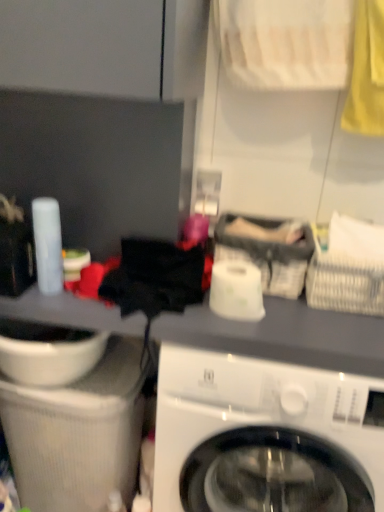
Identify the location of vacant space that is to the left of white glossy toilet paper at center. (170, 313).